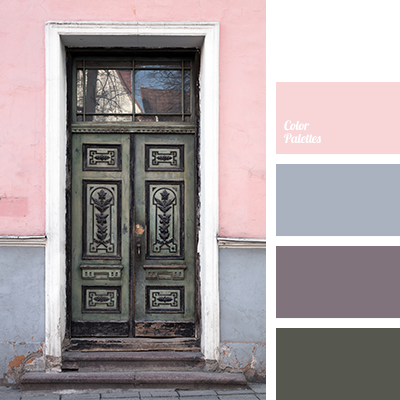
What are the coordinates of `transom` in the screenshot? It's located at (118, 84).